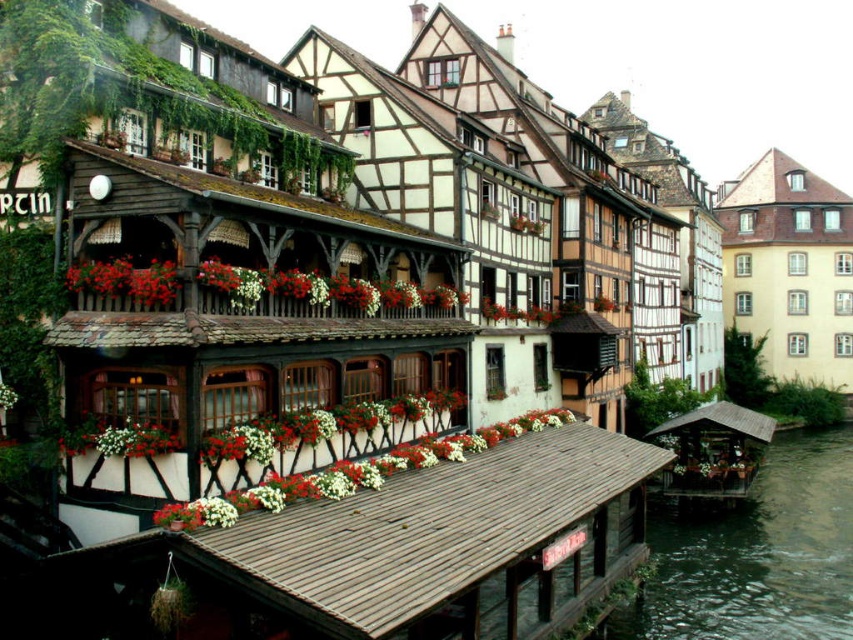
You are standing at the point with coordinates point (76,451) and want to walk to the point with coordinates point (780,600). Is there a clear path between these two points without any obstacles?

Point (780,600) is behind point (76,451), so there might be an obstacle blocking the direct path between them. You might need to go around or find another route.

You are a tourist standing in front of the traditional European riverside buildings. You notice two floral elements at the center of the scene. Which one is located to the left of the other? The options are the vivid red petals at center and the white matte flower box at center.

The vivid red petals at center is positioned on the left side of white matte flower box at center.